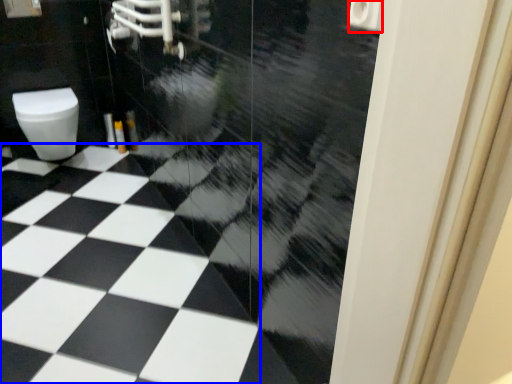
Question: Among these objects, which one is nearest to the camera, toilet paper (highlighted by a red box) or tile (highlighted by a blue box)?

Choices:
 (A) toilet paper
 (B) tile

Answer: (A)